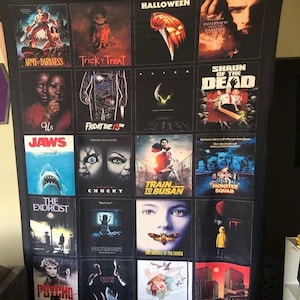
The image size is (300, 300). I want to click on chucky poster, so click(114, 172).